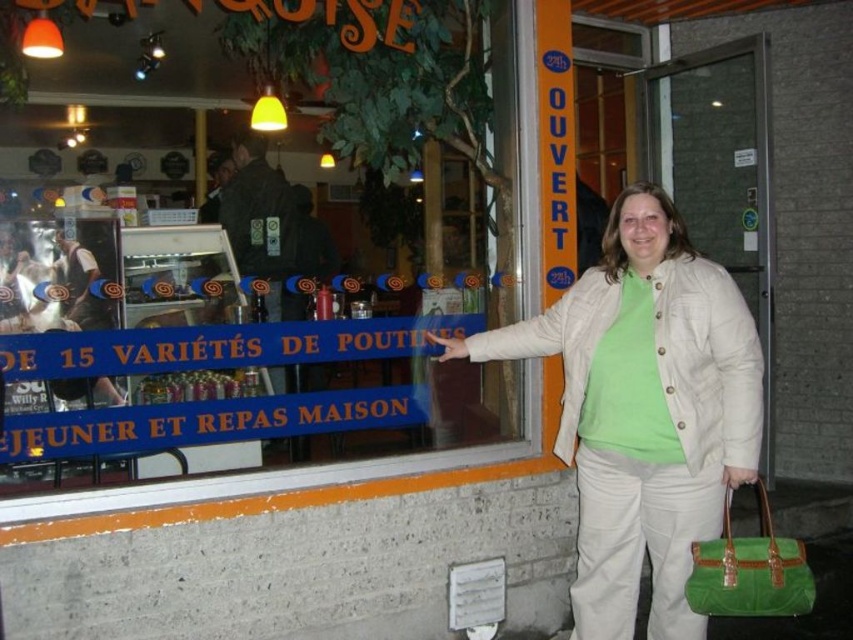
The woman is wearing a white quilted jacket at center and carrying a green fabric handbag at lower right. Which item is bigger in size?

The white quilted jacket at center is larger in size than the green fabric handbag at lower right.

You are a fashion designer analyzing the outfit of the woman in the image. Where is the light beige quilted jacket at center located in terms of coordinates?

The light beige quilted jacket at center is located at coordinates point (643, 410).

You are a fashion designer observing a woman outside a restaurant. You need to decide which item of clothing or accessory is taller between the white quilted jacket at center and the green fabric handbag at lower right. Which one is taller?

The white quilted jacket at center is much taller as green fabric handbag at lower right.